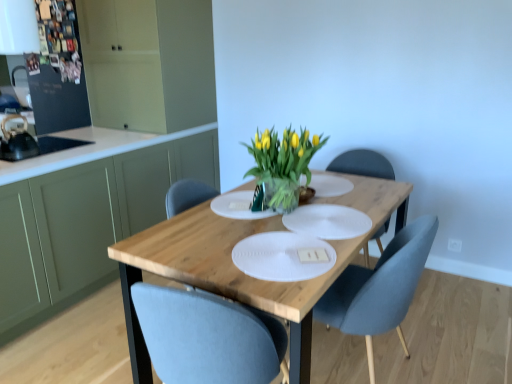
Question: Can you confirm if matte gray chair at center is smaller than green matte cabinet at left, which is the 1th cabinetry in bottom-to-top order?

Choices:
 (A) yes
 (B) no

Answer: (A)

Question: Is the depth of matte gray chair at center less than that of green matte cabinet at left, the second cabinetry positioned from the top?

Choices:
 (A) no
 (B) yes

Answer: (B)

Question: From a real-world perspective, is matte gray chair at center located higher than green matte cabinet at left, the second cabinetry positioned from the top?

Choices:
 (A) no
 (B) yes

Answer: (A)

Question: From the image's perspective, is matte gray chair at center above green matte cabinet at left, the second cabinetry positioned from the top?

Choices:
 (A) yes
 (B) no

Answer: (B)

Question: Can you confirm if matte gray chair at center is positioned to the right of green matte cabinet at left, which is the 1th cabinetry in bottom-to-top order?

Choices:
 (A) yes
 (B) no

Answer: (A)

Question: Is green matte cabinet at left, the second cabinetry positioned from the top, inside matte gray chair at center?

Choices:
 (A) yes
 (B) no

Answer: (B)

Question: Considering the relative positions of white textured placemat at center and green matte cabinet at left, which is the 1th cabinetry from top to bottom, in the image provided, is white textured placemat at center to the right of green matte cabinet at left, which is the 1th cabinetry from top to bottom, from the viewer's perspective?

Choices:
 (A) yes
 (B) no

Answer: (A)

Question: Can you confirm if white textured placemat at center is taller than green matte cabinet at left, placed as the 2th cabinetry when sorted from bottom to top?

Choices:
 (A) no
 (B) yes

Answer: (A)

Question: Is white textured placemat at center turned away from green matte cabinet at left, placed as the 2th cabinetry when sorted from bottom to top?

Choices:
 (A) no
 (B) yes

Answer: (A)

Question: Considering the relative sizes of white textured placemat at center and green matte cabinet at left, which is the 1th cabinetry from top to bottom, in the image provided, is white textured placemat at center smaller than green matte cabinet at left, which is the 1th cabinetry from top to bottom,?

Choices:
 (A) no
 (B) yes

Answer: (B)

Question: From the image's perspective, is white textured placemat at center located beneath green matte cabinet at left, placed as the 2th cabinetry when sorted from bottom to top?

Choices:
 (A) no
 (B) yes

Answer: (B)

Question: Would you say white textured placemat at center is a long distance from green matte cabinet at left, placed as the 2th cabinetry when sorted from bottom to top?

Choices:
 (A) yes
 (B) no

Answer: (A)

Question: Is the position of translucent glass vase at center less distant than that of green matte cabinet at left, which is the 1th cabinetry from top to bottom?

Choices:
 (A) no
 (B) yes

Answer: (B)